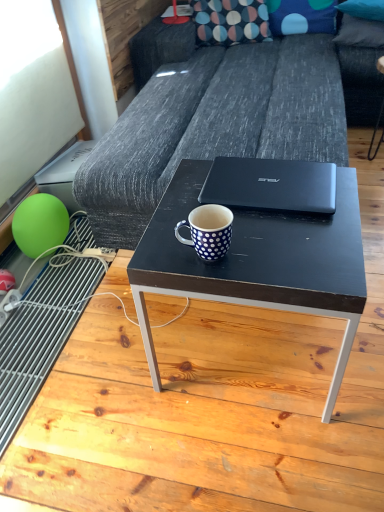
Image resolution: width=384 pixels, height=512 pixels. In order to click on free space to the left of black matte laptop at center in this screenshot , I will do `click(178, 202)`.